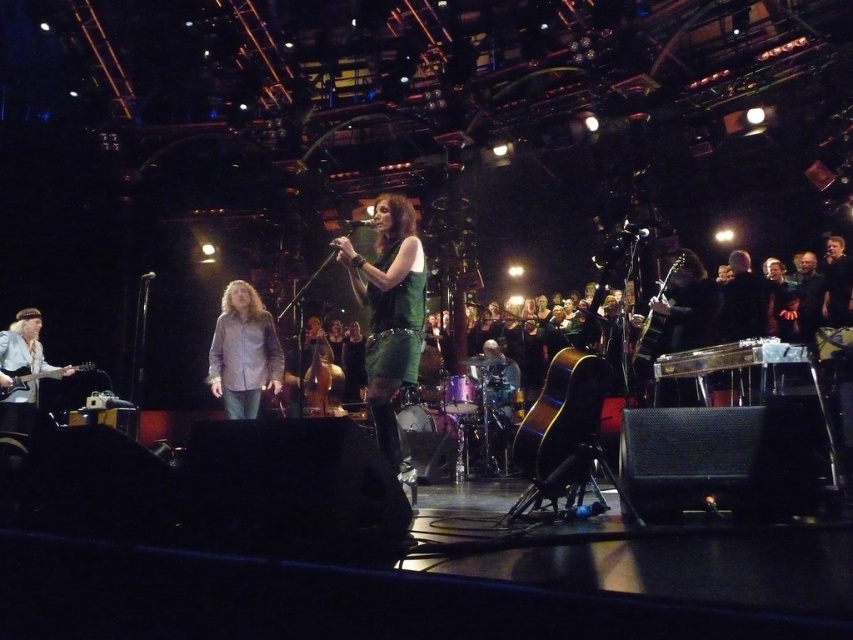
Is metallic silver keyboard at right behind brown wooden cello at center?

No, metallic silver keyboard at right is closer to the viewer.

From the picture: Can you confirm if metallic silver keyboard at right is positioned below brown wooden cello at center?

No, metallic silver keyboard at right is not below brown wooden cello at center.

Is point (657, 372) farther from camera compared to point (332, 378)?

No, it is not.

This screenshot has height=640, width=853. I want to click on metallic silver keyboard at right, so click(x=729, y=356).

Which is above, green leather skirt at center or light brown shirt at center?

Positioned higher is green leather skirt at center.

From the picture: Does green leather skirt at center come behind light brown shirt at center?

No, green leather skirt at center is closer to the viewer.

This screenshot has height=640, width=853. I want to click on green leather skirt at center, so click(389, 310).

Can you confirm if green leather skirt at center is thinner than metallic silver keyboard at right?

Yes, green leather skirt at center is thinner than metallic silver keyboard at right.

Between green leather skirt at center and metallic silver keyboard at right, which one is positioned lower?

metallic silver keyboard at right is lower down.

Who is more distant from viewer, [403,380] or [759,364]?

The point [759,364] is behind.

Locate an element on the screen. The height and width of the screenshot is (640, 853). green leather skirt at center is located at coordinates (389, 310).